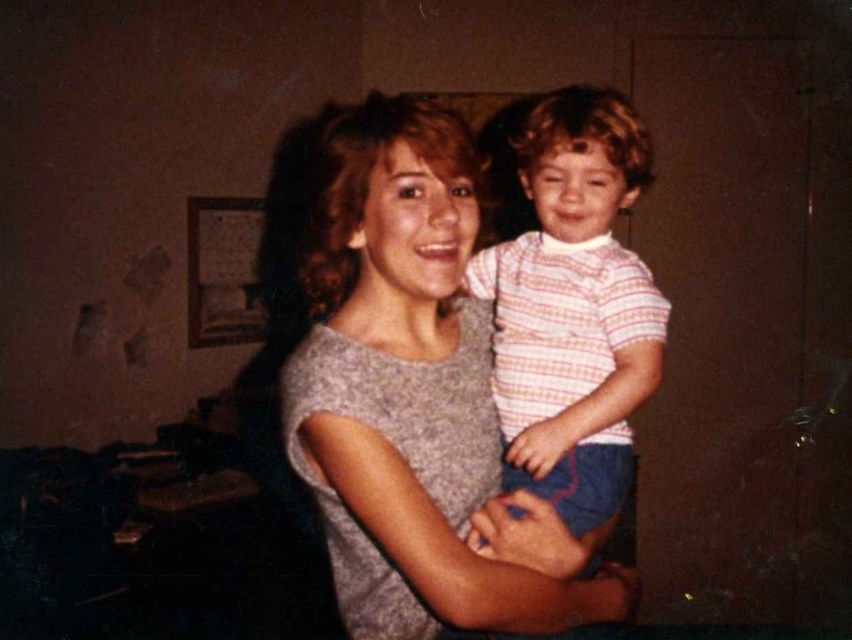
You are designing a new clothing line and want to showcase two shirts in a catalog. You have the gray matte shirt at center and the striped cotton shirt at center. Which shirt should you choose if you want to feature a larger size in your collection?

The gray matte shirt at center has a larger size compared to the striped cotton shirt at center, so you should choose the gray matte shirt at center for showcasing a larger size in the collection.

You are a photographer adjusting the lighting for a portrait. You notice the gray matte shirt at center and the striped cotton shirt at center. Which shirt should you focus on to ensure it appears sharp in the photo?

The gray matte shirt at center is closer to the viewer than the striped cotton shirt at center, so focusing on the gray matte shirt at center will ensure it appears sharp, while the striped cotton shirt at center may appear slightly out of focus due to its distance from the camera.